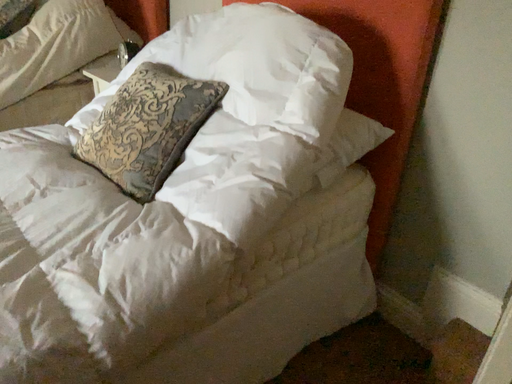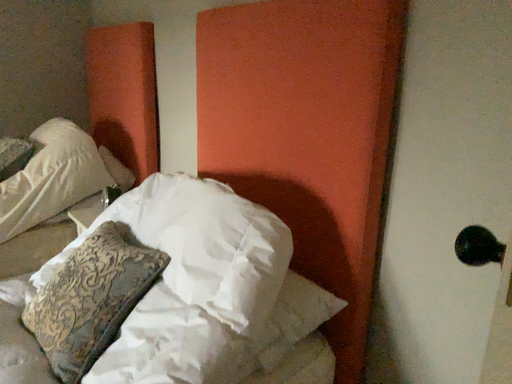
Question: How did the camera likely rotate when shooting the video?

Choices:
 (A) rotated downward
 (B) rotated upward

Answer: (B)